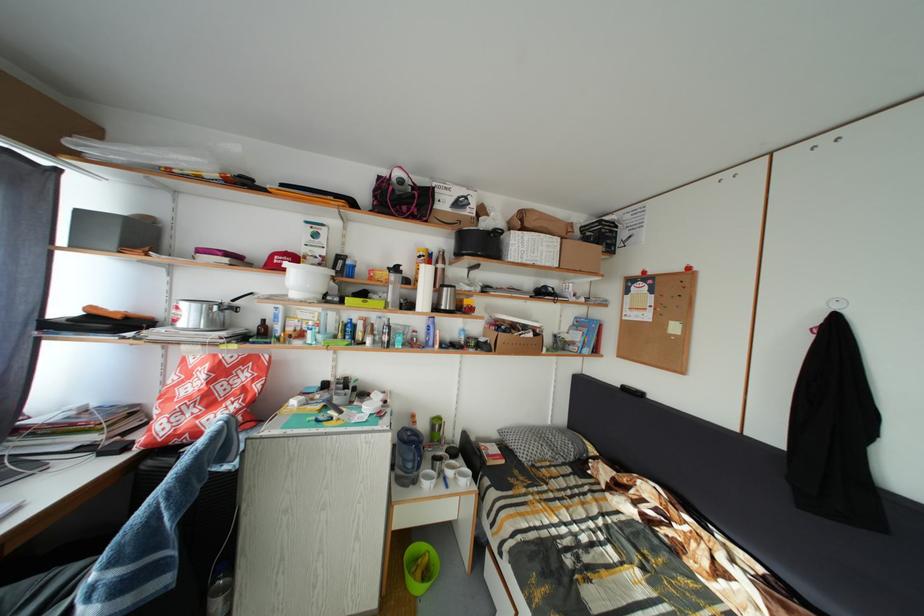
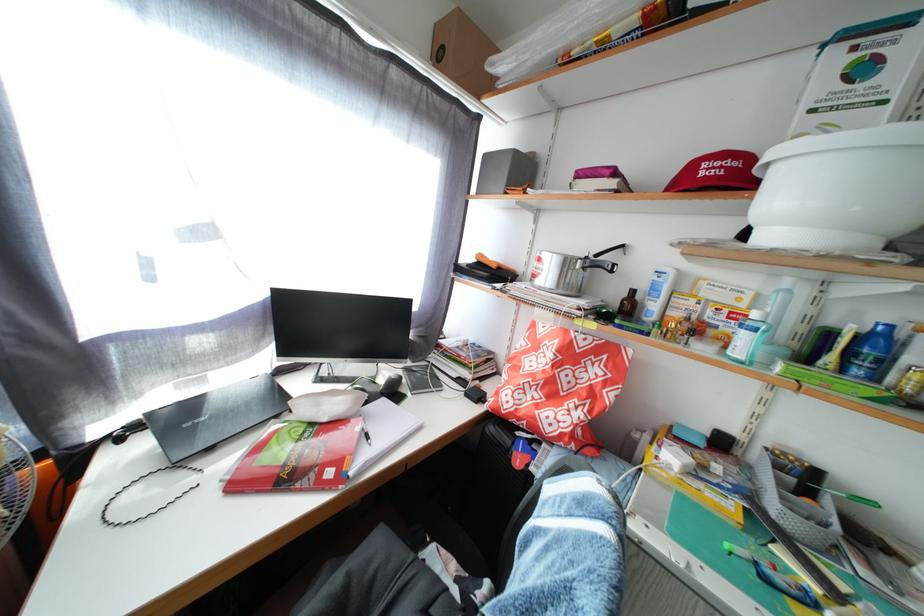
Locate, in the second image, the point that corresponds to point (261, 331) in the first image.

(621, 301)